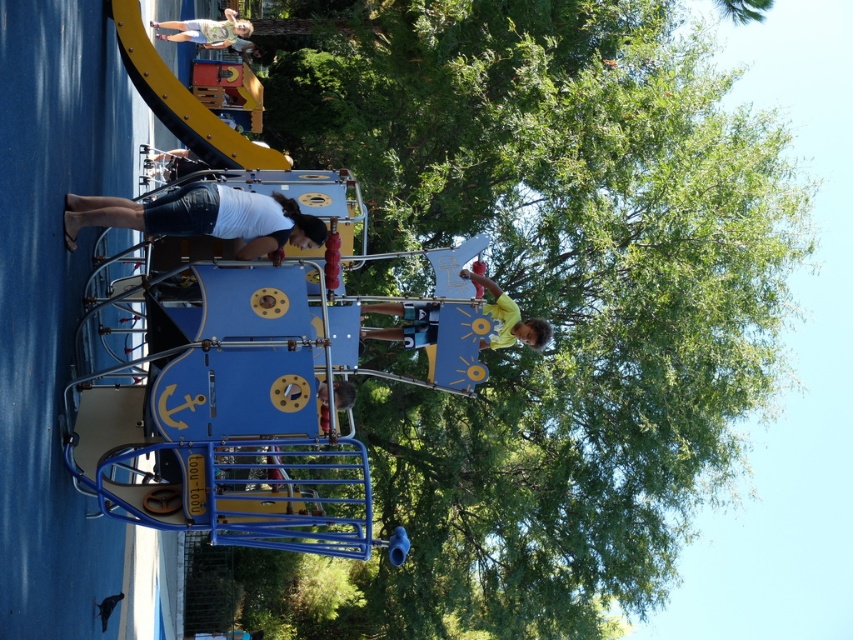
Which of these two, metallic blue ship at center or yellow matte shirt at upper center, stands shorter?

Standing shorter between the two is yellow matte shirt at upper center.

Does metallic blue ship at center appear under yellow matte shirt at upper center?

Actually, metallic blue ship at center is above yellow matte shirt at upper center.

You are a GUI agent. You are given a task and a screenshot of the screen. Output one action in this format:
    pyautogui.click(x=<x>, y=<y>)
    Task: Click on the metallic blue ship at center
    Image resolution: width=853 pixels, height=640 pixels.
    Given the screenshot: What is the action you would take?
    pyautogui.click(x=241, y=422)

How much distance is there between white cotton shorts at lower left and smooth blue swing at center?

2.36 meters

Who is positioned more to the right, white cotton shorts at lower left or smooth blue swing at center?

smooth blue swing at center

Where is `white cotton shorts at lower left`? This screenshot has width=853, height=640. white cotton shorts at lower left is located at coordinates (201, 218).

Can you confirm if light green shirt at upper center is smaller than smooth blue swing at center?

Incorrect, light green shirt at upper center is not smaller in size than smooth blue swing at center.

Does point (242, 24) come closer to viewer compared to point (351, 388)?

No, it is behind (351, 388).

Is point (231, 28) positioned behind point (341, 385)?

Yes, it is behind point (341, 385).

Locate an element on the screen. This screenshot has height=640, width=853. light green shirt at upper center is located at coordinates (212, 33).